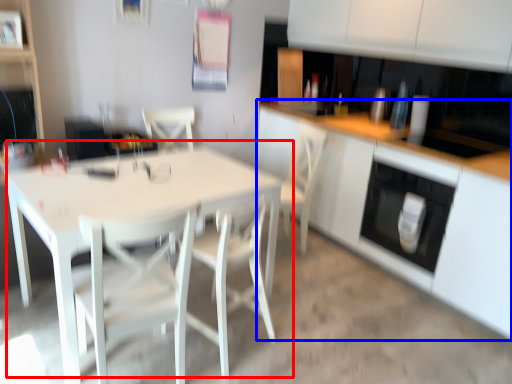
Question: Which object appears closest to the camera in this image, table (highlighted by a red box) or cabinetry (highlighted by a blue box)?

Choices:
 (A) table
 (B) cabinetry

Answer: (A)